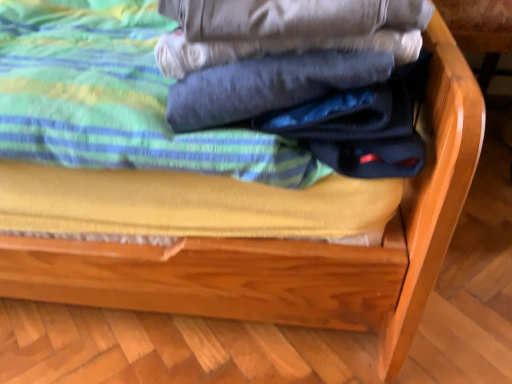
At what (x,y) coordinates should I click in order to perform the action: click on dark blue fleece at center. Please return your answer as a coordinate pair (x, y). The width and height of the screenshot is (512, 384). Looking at the image, I should click on (287, 29).

What do you see at coordinates (287, 29) in the screenshot? The width and height of the screenshot is (512, 384). I see `dark blue fleece at center` at bounding box center [287, 29].

Image resolution: width=512 pixels, height=384 pixels. In order to click on dark blue fleece at center in this screenshot , I will do point(287,29).